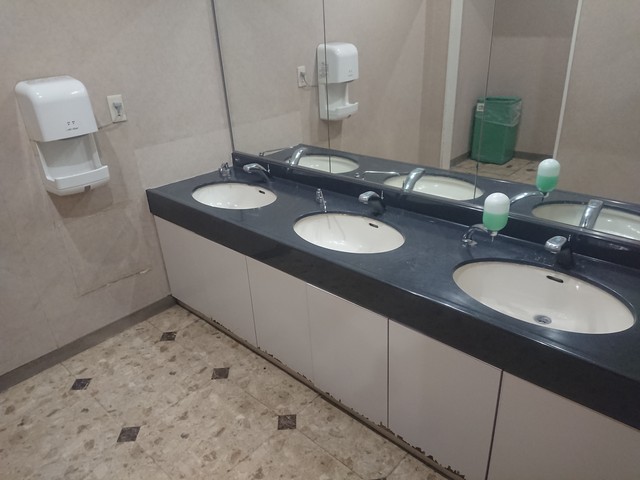
Where is `electrical plug`? Image resolution: width=640 pixels, height=480 pixels. electrical plug is located at coordinates (116, 104).